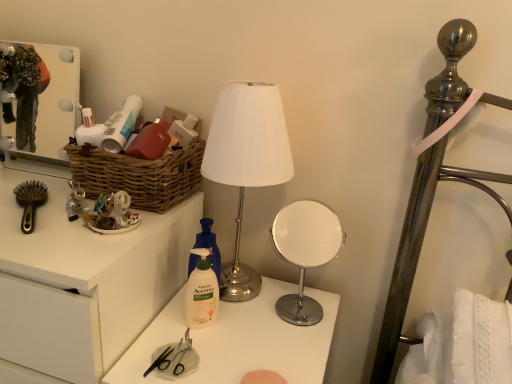
Locate an element on the screen. free space in front of white matte lamp at center is located at coordinates (239, 344).